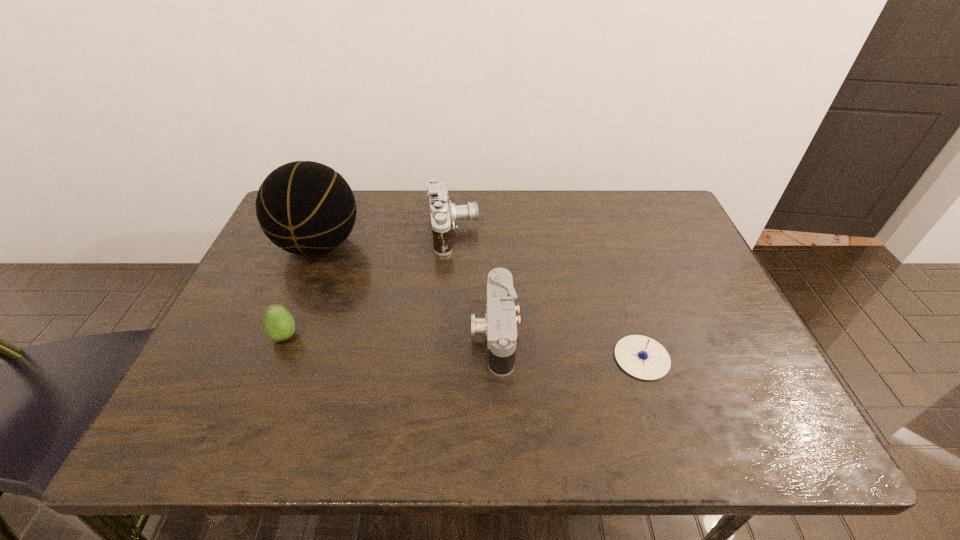
You are a GUI agent. You are given a task and a screenshot of the screen. Output one action in this format:
    pyautogui.click(x=<x>, y=<y>)
    Task: Click on the vacant position located on the lens of the nearer camera
    
    Given the screenshot: What is the action you would take?
    pyautogui.click(x=429, y=333)

Identify the location of free space located 0.080m on the right of the avocado. (333, 336).

You are a GUI agent. You are given a task and a screenshot of the screen. Output one action in this format:
    pyautogui.click(x=<x>, y=<y>)
    Task: Click on the vacant space located on the back of the rightmost object
    
    Given the screenshot: What is the action you would take?
    pyautogui.click(x=616, y=277)

The width and height of the screenshot is (960, 540). In order to click on basketball at the far edge in this screenshot , I will do `click(306, 208)`.

Where is `camera positioned at the far edge`? This screenshot has height=540, width=960. camera positioned at the far edge is located at coordinates (444, 214).

Locate an element on the screen. basketball at the left edge is located at coordinates (306, 208).

The height and width of the screenshot is (540, 960). In order to click on avocado present at the left edge in this screenshot , I will do point(278,323).

Locate an element on the screen. This screenshot has height=540, width=960. object situated at the far left corner is located at coordinates (306, 208).

Identify the location of free space at the far edge of the desktop. The width and height of the screenshot is (960, 540). (575, 221).

The height and width of the screenshot is (540, 960). Find the location of `free space at the right edge of the desktop`. free space at the right edge of the desktop is located at coordinates (636, 237).